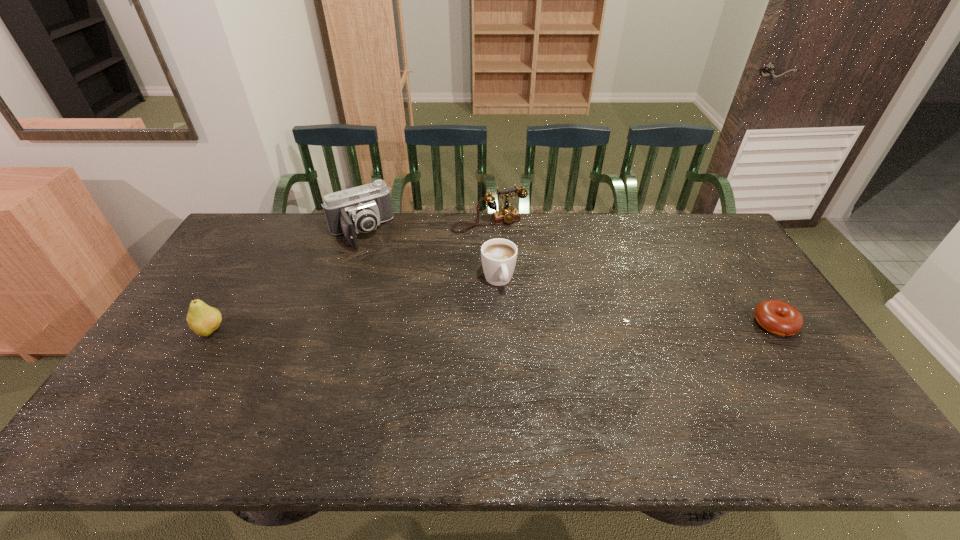
I want to click on blank area in the image that satisfies the following two spatial constraints: 1. on the front side of the shortest object; 2. on the right side of the cappuccino, so click(x=500, y=323).

Find the location of a particular element. blank space that satisfies the following two spatial constraints: 1. on the back side of the telephone; 2. on the left side of the second object from left to right is located at coordinates (364, 224).

This screenshot has height=540, width=960. I want to click on free location that satisfies the following two spatial constraints: 1. on the front side of the rightmost object; 2. on the left side of the camera, so click(x=329, y=323).